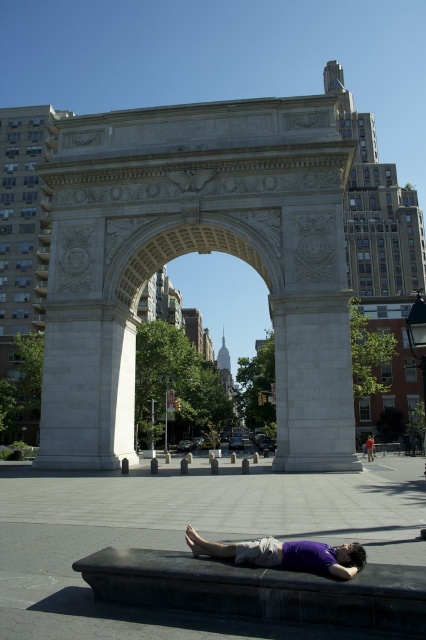
Which is below, purple matte shirt at lower center or purple fabric at lower center?

purple fabric at lower center

Where is `purple matte shirt at lower center`? The image size is (426, 640). purple matte shirt at lower center is located at coordinates (284, 554).

Is point (324, 554) more distant than point (373, 451)?

No.

Image resolution: width=426 pixels, height=640 pixels. I want to click on purple matte shirt at lower center, so click(284, 554).